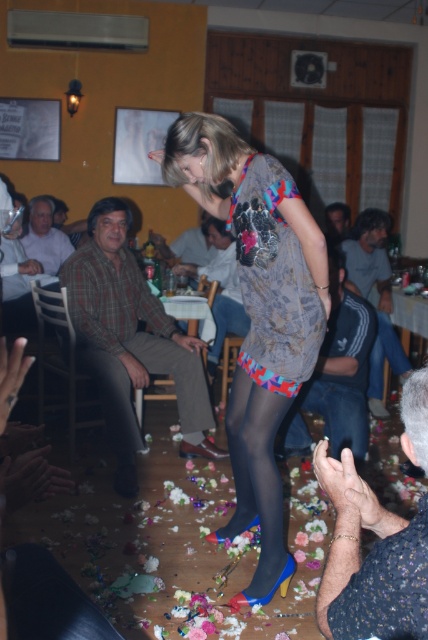
Question: Which of these objects is positioned farthest from the plaid fabric shirt at left?

Choices:
 (A) plaid fabric shirt at center
 (B) smooth skin hands at lower right

Answer: (B)

Question: Is plaid fabric shirt at left behind jeans at center?

Choices:
 (A) yes
 (B) no

Answer: (B)

Question: Estimate the real-world distances between objects in this image. Which object is closer to the plaid fabric shirt at left?

Choices:
 (A) dark gray adidas tracksuit at right
 (B) matte floral dress at center
 (C) jeans at center
 (D) smooth skin hands at lower right

Answer: (C)

Question: Does smooth skin hands at lower right come behind plaid fabric shirt at center?

Choices:
 (A) yes
 (B) no

Answer: (B)

Question: Is jeans at center above black sheer tights at center?

Choices:
 (A) yes
 (B) no

Answer: (A)

Question: Among these objects, which one is farthest from the camera?

Choices:
 (A) matte floral dress at center
 (B) plaid fabric shirt at left
 (C) black sheer tights at center
 (D) dark gray adidas tracksuit at right

Answer: (D)